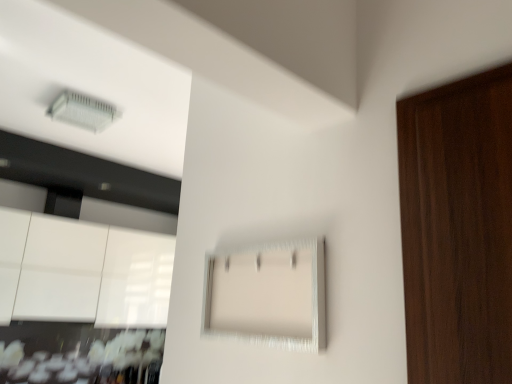
Question: Can you see clear plastic air conditioning unit at upper left touching glossy white cabinetry at lower left, the 1th cabinetry when ordered from back to front?

Choices:
 (A) yes
 (B) no

Answer: (B)

Question: Does clear plastic air conditioning unit at upper left appear on the left side of glossy white cabinetry at lower left, which is the second cabinetry in right-to-left order?

Choices:
 (A) no
 (B) yes

Answer: (A)

Question: Is clear plastic air conditioning unit at upper left shorter than glossy white cabinetry at lower left, marked as the 2th cabinetry in a front-to-back arrangement?

Choices:
 (A) yes
 (B) no

Answer: (A)

Question: From a real-world perspective, is clear plastic air conditioning unit at upper left physically above glossy white cabinetry at lower left, which is the second cabinetry in right-to-left order?

Choices:
 (A) yes
 (B) no

Answer: (A)

Question: Is clear plastic air conditioning unit at upper left not inside glossy white cabinetry at lower left, the 1th cabinetry in the left-to-right sequence?

Choices:
 (A) no
 (B) yes

Answer: (B)

Question: From the image's perspective, is clear plastic air conditioning unit at upper left beneath glossy white cabinetry at lower left, the 1th cabinetry when ordered from back to front?

Choices:
 (A) yes
 (B) no

Answer: (B)

Question: Does glossy white cabinetry at lower left, the 1th cabinetry in the left-to-right sequence, appear on the right side of white textured cabinet at center, which is the first cabinetry in right-to-left order?

Choices:
 (A) no
 (B) yes

Answer: (A)

Question: Would you say white textured cabinet at center, arranged as the second cabinetry when viewed from the left, is part of glossy white cabinetry at lower left, which is the second cabinetry in right-to-left order,'s contents?

Choices:
 (A) no
 (B) yes

Answer: (A)

Question: Does glossy white cabinetry at lower left, which is the second cabinetry in right-to-left order, touch white textured cabinet at center, positioned as the 2th cabinetry in back-to-front order?

Choices:
 (A) yes
 (B) no

Answer: (B)

Question: Does glossy white cabinetry at lower left, marked as the 2th cabinetry in a front-to-back arrangement, have a greater height compared to white textured cabinet at center, arranged as the second cabinetry when viewed from the left?

Choices:
 (A) yes
 (B) no

Answer: (A)

Question: From a real-world perspective, is glossy white cabinetry at lower left, which is the second cabinetry in right-to-left order, physically above white textured cabinet at center, which is the first cabinetry in right-to-left order?

Choices:
 (A) yes
 (B) no

Answer: (A)

Question: Is glossy white cabinetry at lower left, the 1th cabinetry when ordered from back to front, thinner than white textured cabinet at center, which is the first cabinetry in right-to-left order?

Choices:
 (A) yes
 (B) no

Answer: (B)

Question: Is white textured cabinet at center, placed as the first cabinetry when sorted from front to back, facing towards clear plastic air conditioning unit at upper left?

Choices:
 (A) yes
 (B) no

Answer: (B)